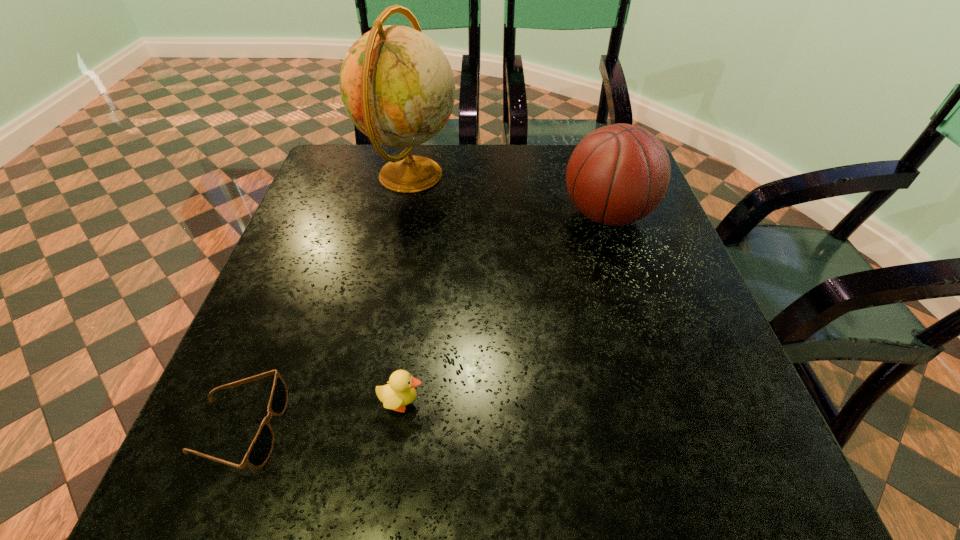
Image resolution: width=960 pixels, height=540 pixels. Find the location of `the tallest object`. the tallest object is located at coordinates (397, 86).

Where is `the rightmost object`? This screenshot has height=540, width=960. the rightmost object is located at coordinates (618, 174).

Identify the location of the third shortest object. (618, 174).

Where is `the third tallest object`? The height and width of the screenshot is (540, 960). the third tallest object is located at coordinates (400, 391).

Find the location of `the shortest object`. the shortest object is located at coordinates (261, 448).

Locate an element on the screen. The image size is (960, 540). free space located on the right of the globe is located at coordinates [x=498, y=175].

Identify the location of free space located on the back of the basketball. (587, 151).

Find the location of a particular element. free space located on the front-facing side of the duckling is located at coordinates pos(556,402).

What are the coordinates of `vacant area located on the frames of the sunglasses` in the screenshot? It's located at (448, 428).

Find the location of a particular element. globe present at the far edge is located at coordinates (397, 86).